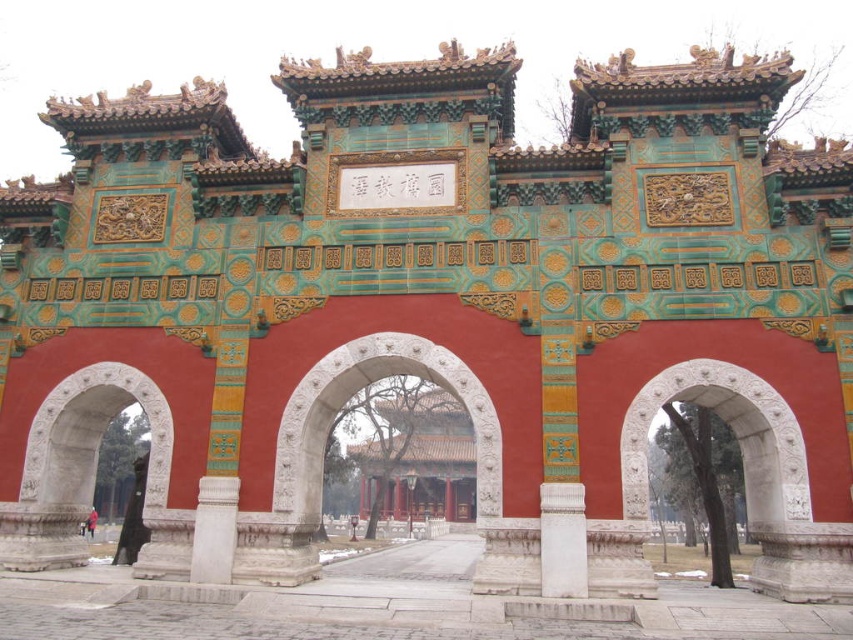
Does white stone archway at right come behind white marble pillar at center?

No, it is in front of white marble pillar at center.

This screenshot has height=640, width=853. What do you see at coordinates (734, 433) in the screenshot? I see `white stone archway at right` at bounding box center [734, 433].

Which is in front, point (808, 499) or point (218, 538)?

Positioned in front is point (808, 499).

Locate an element on the screen. This screenshot has height=640, width=853. white stone archway at right is located at coordinates (734, 433).

Is white stone archway at left wider than white marble pillar at center?

Indeed, white stone archway at left has a greater width compared to white marble pillar at center.

Is white stone archway at left further to the viewer compared to white marble pillar at center?

That is True.

Is point (115, 397) less distant than point (193, 573)?

No, it is not.

Image resolution: width=853 pixels, height=640 pixels. Identify the location of white stone archway at left. (77, 464).

Who is more distant from viewer, (213, 552) or (85, 522)?

Positioned behind is point (85, 522).

Locate an element on the screen. This screenshot has height=640, width=853. white marble pillar at center is located at coordinates [x=213, y=529].

Locate an element on the screen. Image resolution: width=853 pixels, height=640 pixels. white marble pillar at center is located at coordinates (213, 529).